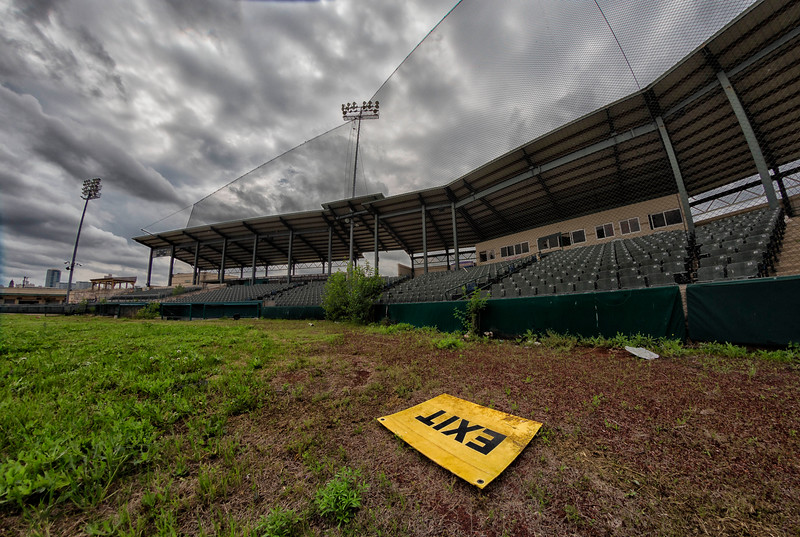
Locate an element on the screen. yellow exit sign is located at coordinates (457, 454).